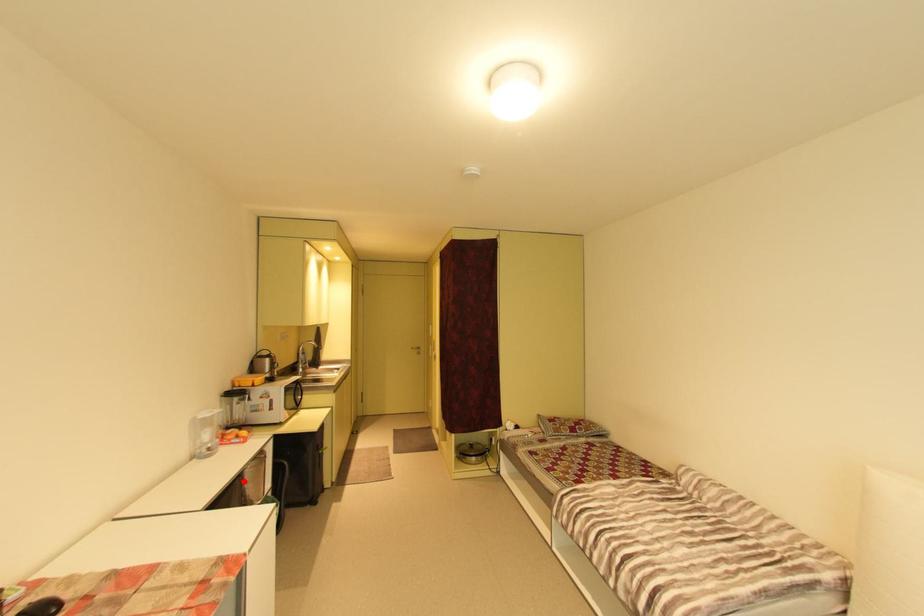
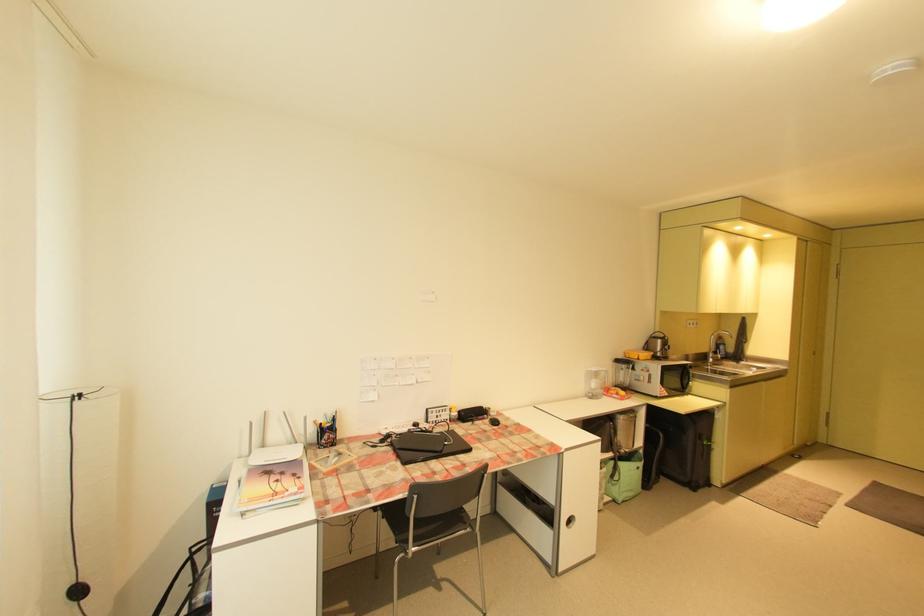
Question: I am providing you with two images of the same scene from different viewpoints. A red point is shown in image1. For the corresponding object point in image2, is it positioned nearer or farther from the camera?

Choices:
 (A) Nearer
 (B) Farther

Answer: (B)